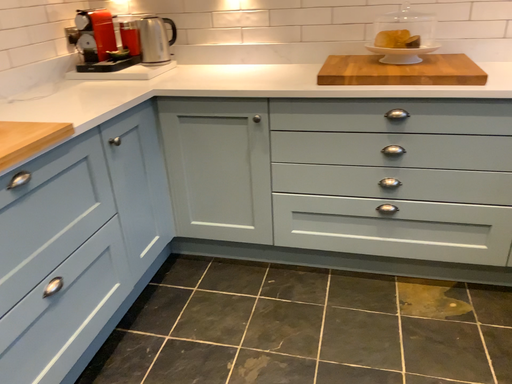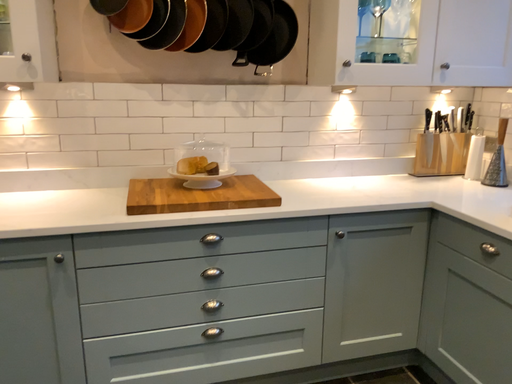
Question: How did the camera likely rotate when shooting the video?

Choices:
 (A) rotated downward
 (B) rotated upward

Answer: (B)